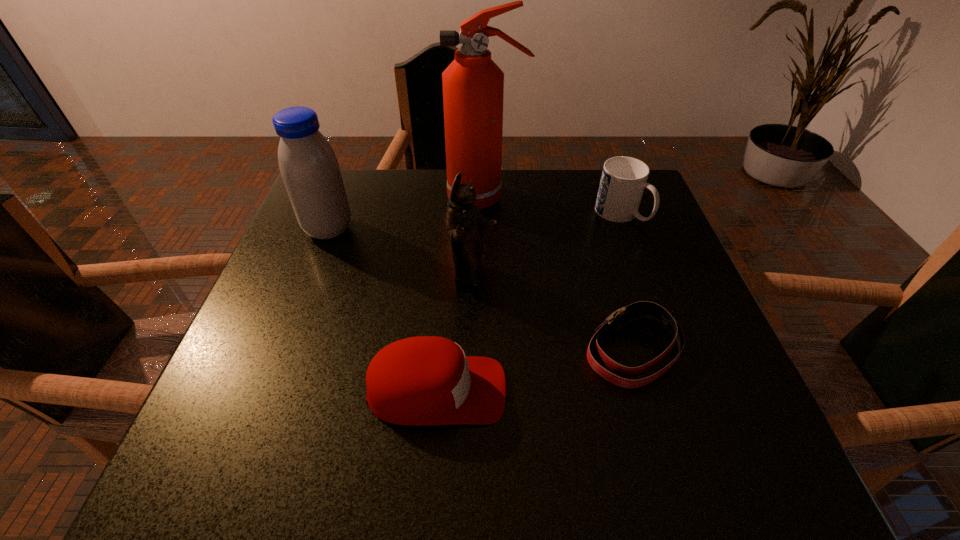
Identify the location of free space located 0.370m on the right of the soya milk. This screenshot has height=540, width=960. (503, 229).

Identify the location of vacant space located on the front-facing side of the figurine. (609, 278).

The height and width of the screenshot is (540, 960). Find the location of `vacant space situated 0.200m on the left of the fourth tallest object`. vacant space situated 0.200m on the left of the fourth tallest object is located at coordinates (518, 214).

Image resolution: width=960 pixels, height=540 pixels. What are the coordinates of `free space located 0.270m on the front-facing side of the fifth tallest object` in the screenshot? It's located at click(660, 391).

Where is `vacant space located 0.310m on the left of the shortest object`? vacant space located 0.310m on the left of the shortest object is located at coordinates (420, 350).

This screenshot has width=960, height=540. I want to click on fire extinguisher that is positioned at the far edge, so click(473, 85).

Locate an element on the screen. The width and height of the screenshot is (960, 540). soya milk present at the far edge is located at coordinates (308, 165).

You are a GUI agent. You are given a task and a screenshot of the screen. Output one action in this format:
    pyautogui.click(x=<x>, y=<y>)
    Task: Click on the mug that is at the far edge
    The image size is (960, 540).
    Given the screenshot: What is the action you would take?
    pyautogui.click(x=623, y=180)

Where is `object situated at the near edge`? The height and width of the screenshot is (540, 960). object situated at the near edge is located at coordinates coord(425,380).

Where is `object that is at the left edge`? object that is at the left edge is located at coordinates (308, 165).